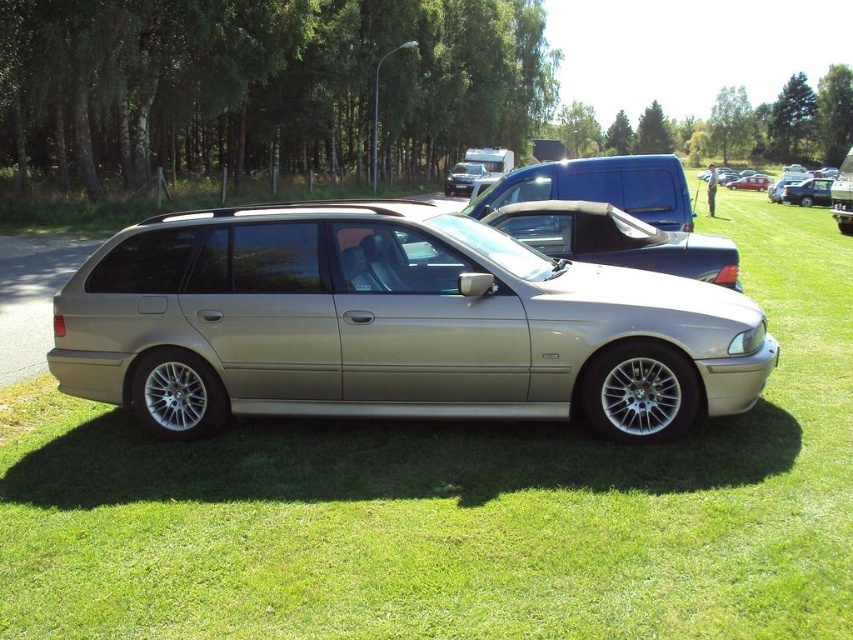
The width and height of the screenshot is (853, 640). What do you see at coordinates (457, 506) in the screenshot?
I see `metallic silver car at center` at bounding box center [457, 506].

Who is more distant from viewer, (x=254, y=512) or (x=660, y=413)?

The point (x=660, y=413) is more distant.

Which is behind, point (766, 554) or point (366, 364)?

The point (366, 364) is behind.

Where is `metallic silver car at center`? The width and height of the screenshot is (853, 640). metallic silver car at center is located at coordinates (457, 506).

Can you confirm if satin silver car at center is positioned to the right of black plastic license plate at center?

In fact, satin silver car at center is to the left of black plastic license plate at center.

Is point (328, 230) farther from viewer compared to point (842, 208)?

No, it is in front of (842, 208).

Locate an element on the screen. This screenshot has height=640, width=853. satin silver car at center is located at coordinates (x=392, y=324).

Does blue matte van at center have a greater width compared to metallic silver station wagon at center?

No, blue matte van at center is not wider than metallic silver station wagon at center.

Where is `blue matte van at center`? blue matte van at center is located at coordinates (599, 186).

You are a GUI agent. You are given a task and a screenshot of the screen. Output one action in this format:
    pyautogui.click(x=<x>, y=<y>)
    Task: Click on the blue matte van at center
    
    Given the screenshot: What is the action you would take?
    pyautogui.click(x=599, y=186)